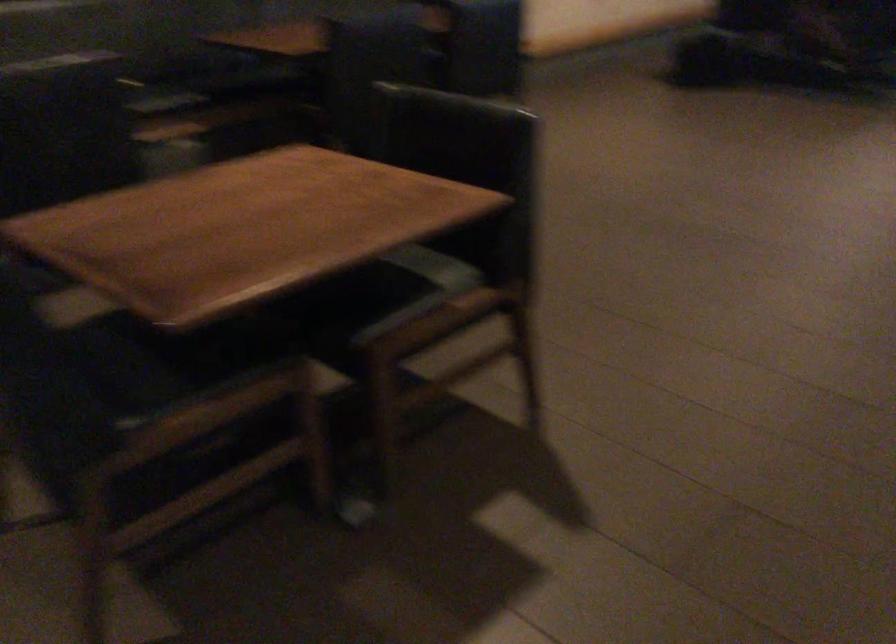
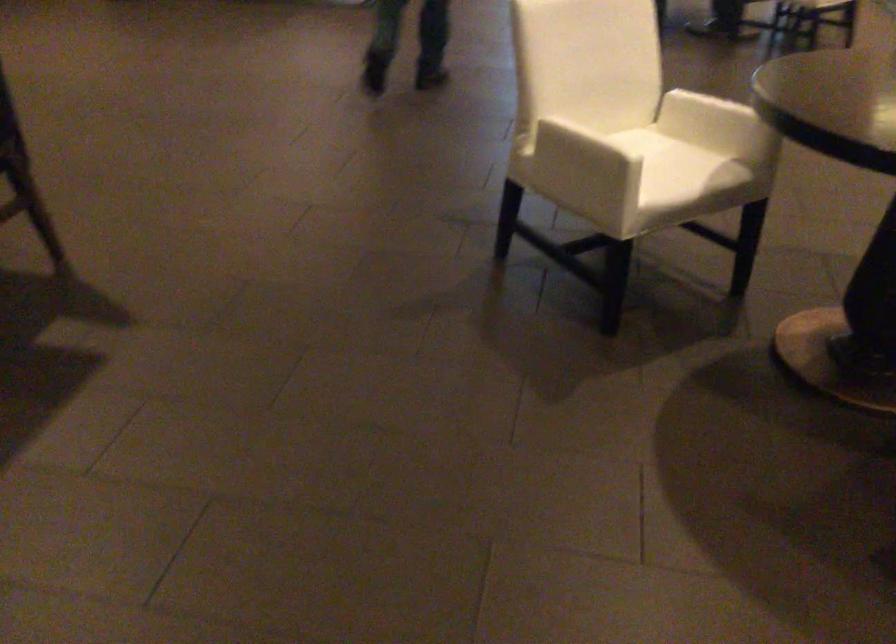
Question: The camera is either moving clockwise (left) or counter-clockwise (right) around the object. The first image is from the beginning of the video and the second image is from the end. Is the camera moving left or right when shooting the video?

Choices:
 (A) Left
 (B) Right

Answer: (A)